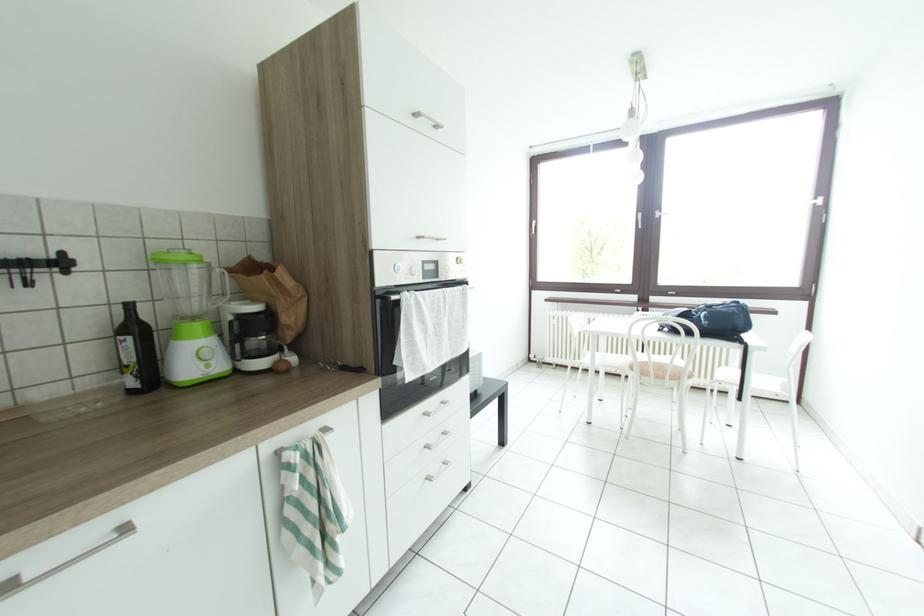
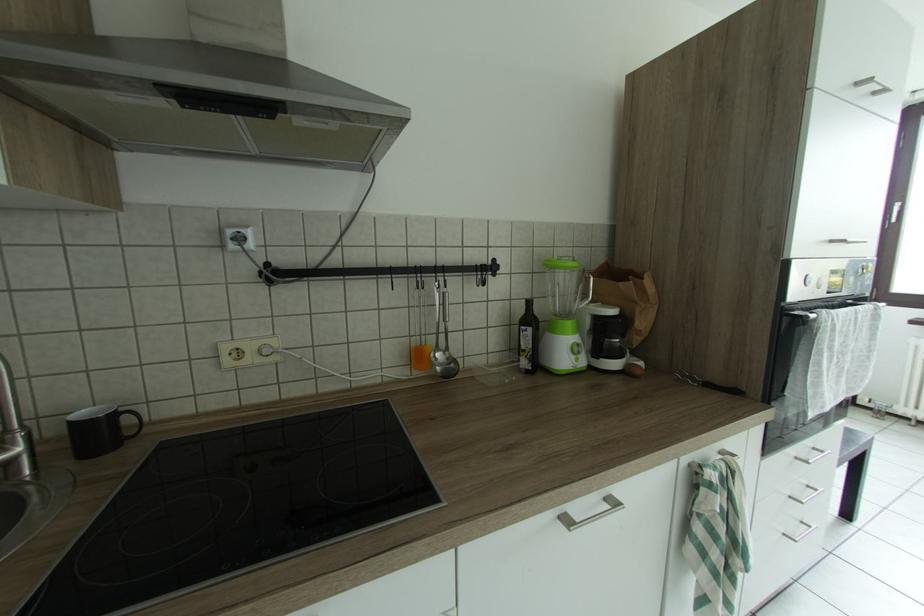
Question: The images are taken continuously from a first-person perspective. In which direction is your viewpoint rotating?

Choices:
 (A) Left
 (B) Right
 (C) Up
 (D) Down

Answer: (A)